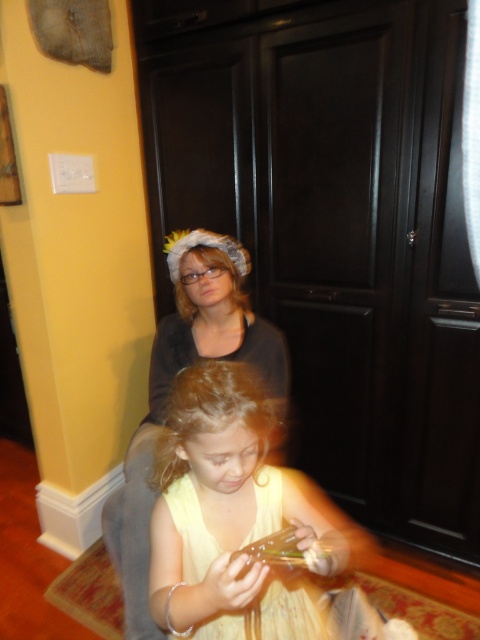
Is blonde curly hair at center to the left of blonde silky hair at upper center from the viewer's perspective?

In fact, blonde curly hair at center is to the right of blonde silky hair at upper center.

Is blonde curly hair at center positioned behind blonde silky hair at upper center?

No, it is not.

You are a GUI agent. You are given a task and a screenshot of the screen. Output one action in this format:
    pyautogui.click(x=<x>, y=<y>)
    Task: Click on the blonde curly hair at center
    The width and height of the screenshot is (480, 640).
    Given the screenshot: What is the action you would take?
    pyautogui.click(x=215, y=413)

Image resolution: width=480 pixels, height=640 pixels. Identify the location of blonde curly hair at center. (215, 413).

Is matte black shirt at upper center wider than blonde curly hair at center?

Yes, matte black shirt at upper center is wider than blonde curly hair at center.

Who is shorter, matte black shirt at upper center or blonde curly hair at center?

With less height is blonde curly hair at center.

Is point (162, 340) farther from viewer compared to point (280, 442)?

No, (162, 340) is in front of (280, 442).

The width and height of the screenshot is (480, 640). What are the coordinates of `matte black shirt at upper center` in the screenshot? It's located at (169, 387).

Does matte black shirt at upper center lie behind yellow satin dress at lower center?

Yes, it is.

Is matte black shirt at upper center bigger than yellow satin dress at lower center?

Yes, matte black shirt at upper center is bigger than yellow satin dress at lower center.

This screenshot has height=640, width=480. What do you see at coordinates (169, 387) in the screenshot? I see `matte black shirt at upper center` at bounding box center [169, 387].

Where is `matte black shirt at upper center`? matte black shirt at upper center is located at coordinates (169, 387).